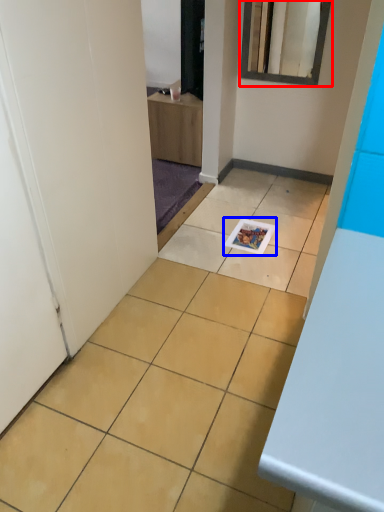
Question: Which of the following is the closest to the observer, mirror (highlighted by a red box) or magazine (highlighted by a blue box)?

Choices:
 (A) mirror
 (B) magazine

Answer: (B)